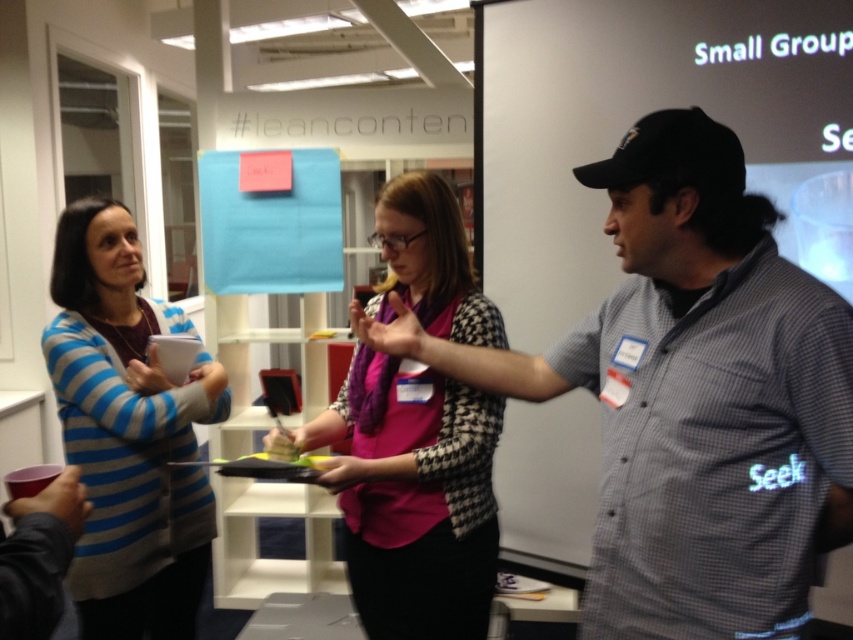
Question: Is gray checkered shirt at center below pink fabric scarf at center?

Choices:
 (A) yes
 (B) no

Answer: (B)

Question: Which point is closer to the camera?

Choices:
 (A) pink fabric scarf at center
 (B) gray checkered shirt at center

Answer: (B)

Question: Is pink fabric scarf at center thinner than blue striped sweater at left?

Choices:
 (A) yes
 (B) no

Answer: (B)

Question: Estimate the real-world distances between objects in this image. Which object is farther from the pink fabric scarf at center?

Choices:
 (A) blue striped sweater at left
 (B) gray checkered shirt at center

Answer: (A)

Question: Considering the relative positions of pink fabric scarf at center and blue striped sweater at left in the image provided, where is pink fabric scarf at center located with respect to blue striped sweater at left?

Choices:
 (A) above
 (B) below

Answer: (A)

Question: Estimate the real-world distances between objects in this image. Which object is farther from the gray checkered shirt at center?

Choices:
 (A) pink fabric scarf at center
 (B) blue striped sweater at left

Answer: (B)